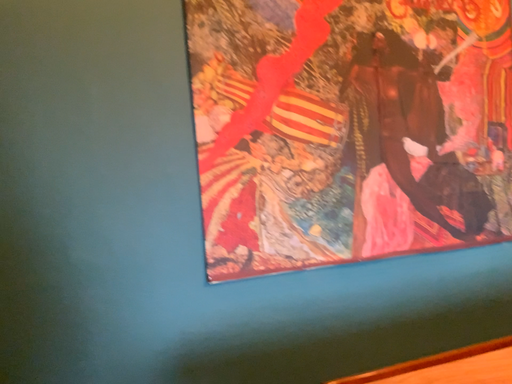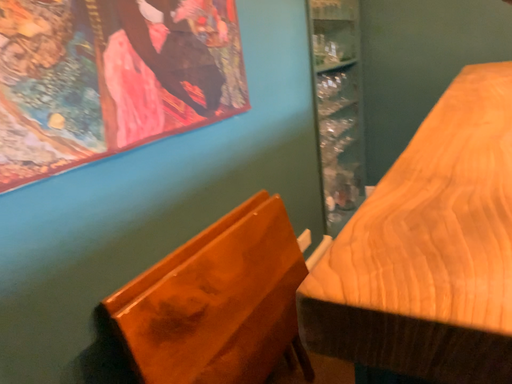
Question: How did the camera likely rotate when shooting the video?

Choices:
 (A) rotated right
 (B) rotated left

Answer: (A)